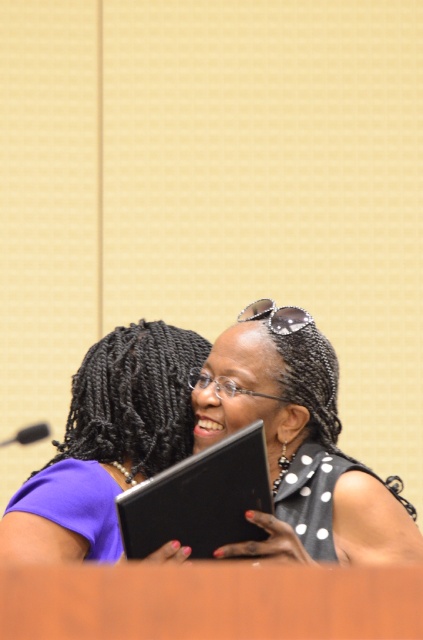
You are a photographer standing at the camera position. You want to take a closeup shot of the black dotted dress at center. Is the dress within your camera range if the camera can focus up to 4 meters?

The black dotted dress at center is 3.77 meters from camera, which is within the camera focus range of up to 4 meters. Therefore, the dress is within the camera range.

Based on the photo, you are a fashion designer observing two dresses displayed at the center of a runway show. The black dotted dress at center and the purple matte dress at center are part of your new collection. Which dress has a shorter length?

The black dotted dress at center is shorter than the purple matte dress at center, so the black dotted dress at center has a shorter length.

You are a fashion designer observing two dresses displayed in a store window. The black dotted dress at center and the purple matte dress at center are both on display. From the perspective of a customer standing in front of the window, which dress is located to the right?

The black dotted dress at center is positioned on the right side of the purple matte dress at center, so from the customer perspective, the black dotted dress at center is on the right.